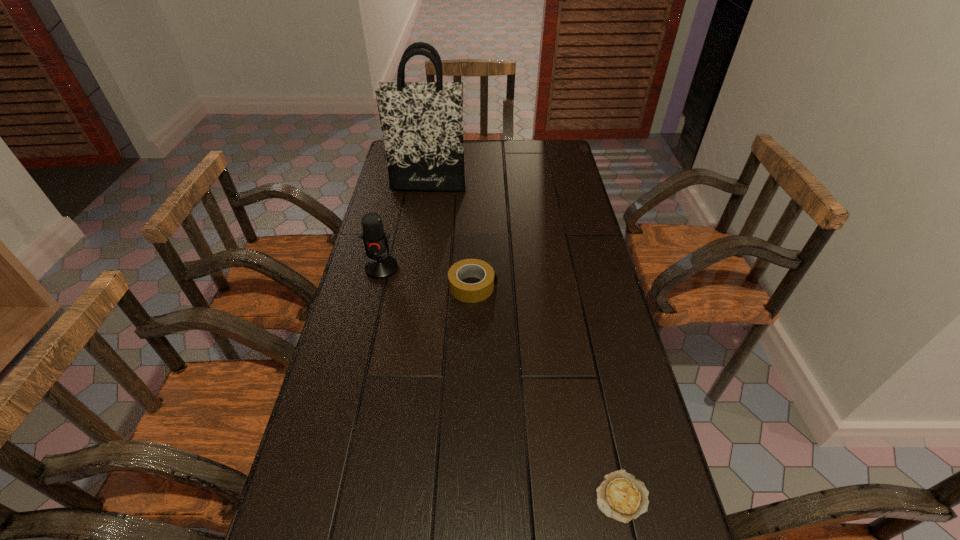
I want to click on vacant space that satisfies the following two spatial constraints: 1. on the side of the rightmost object with the red ring; 2. on the right side of the microphone, so [x=328, y=496].

In order to click on free space that satisfies the following two spatial constraints: 1. on the side of the shortest object with the red ring; 2. on the left side of the microphone in this screenshot , I will do `click(328, 496)`.

Where is `vacant space that satisfies the following two spatial constraints: 1. at the edge of the third tallest object; 2. on the back side of the nearest object`? vacant space that satisfies the following two spatial constraints: 1. at the edge of the third tallest object; 2. on the back side of the nearest object is located at coordinates (469, 496).